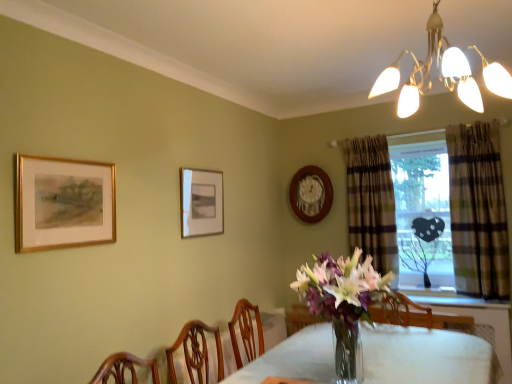
Question: Can you confirm if plaid fabric curtain at right, the 2th curtain positioned from the right, is bigger than wooden clock at upper center, which is the 3th picture frame in left-to-right order?

Choices:
 (A) yes
 (B) no

Answer: (A)

Question: Is plaid fabric curtain at right, the 2th curtain positioned from the right, directly adjacent to wooden clock at upper center, acting as the 1th picture frame starting from the right?

Choices:
 (A) no
 (B) yes

Answer: (A)

Question: Does plaid fabric curtain at right, the 2th curtain positioned from the right, have a greater width compared to wooden clock at upper center, which is counted as the first picture frame, starting from the back?

Choices:
 (A) yes
 (B) no

Answer: (A)

Question: Is plaid fabric curtain at right, the 2th curtain positioned from the right, not inside wooden clock at upper center, which is the 3th picture frame in left-to-right order?

Choices:
 (A) no
 (B) yes

Answer: (B)

Question: Does plaid fabric curtain at right, the 2th curtain positioned from the right, have a greater height compared to wooden clock at upper center, acting as the 1th picture frame starting from the right?

Choices:
 (A) no
 (B) yes

Answer: (B)

Question: Is point (308, 205) closer or farther from the camera than point (453, 347)?

Choices:
 (A) closer
 (B) farther

Answer: (B)

Question: Considering the positions of wooden clock at upper center, which is counted as the first picture frame, starting from the back, and clear glass table at center in the image, is wooden clock at upper center, which is counted as the first picture frame, starting from the back, wider or thinner than clear glass table at center?

Choices:
 (A) thin
 (B) wide

Answer: (A)

Question: From their relative heights in the image, would you say wooden clock at upper center, the third picture frame from the front, is taller or shorter than clear glass table at center?

Choices:
 (A) tall
 (B) short

Answer: (A)

Question: Would you say wooden clock at upper center, which is the 3th picture frame in left-to-right order, is to the left or to the right of clear glass table at center in the picture?

Choices:
 (A) right
 (B) left

Answer: (B)

Question: Considering the relative positions of white glossy chandelier at upper right and clear glass table at center in the image provided, is white glossy chandelier at upper right to the left or to the right of clear glass table at center?

Choices:
 (A) right
 (B) left

Answer: (A)

Question: Is point (452, 87) positioned closer to the camera than point (318, 354)?

Choices:
 (A) farther
 (B) closer

Answer: (B)

Question: From their relative heights in the image, would you say white glossy chandelier at upper right is taller or shorter than clear glass table at center?

Choices:
 (A) short
 (B) tall

Answer: (B)

Question: Is white glossy chandelier at upper right in front of or behind clear glass table at center in the image?

Choices:
 (A) front
 (B) behind

Answer: (A)

Question: Relative to clear glass table at center, is transparent glass heart at center in front or behind?

Choices:
 (A) behind
 (B) front

Answer: (A)

Question: In terms of size, does transparent glass heart at center appear bigger or smaller than clear glass table at center?

Choices:
 (A) small
 (B) big

Answer: (A)